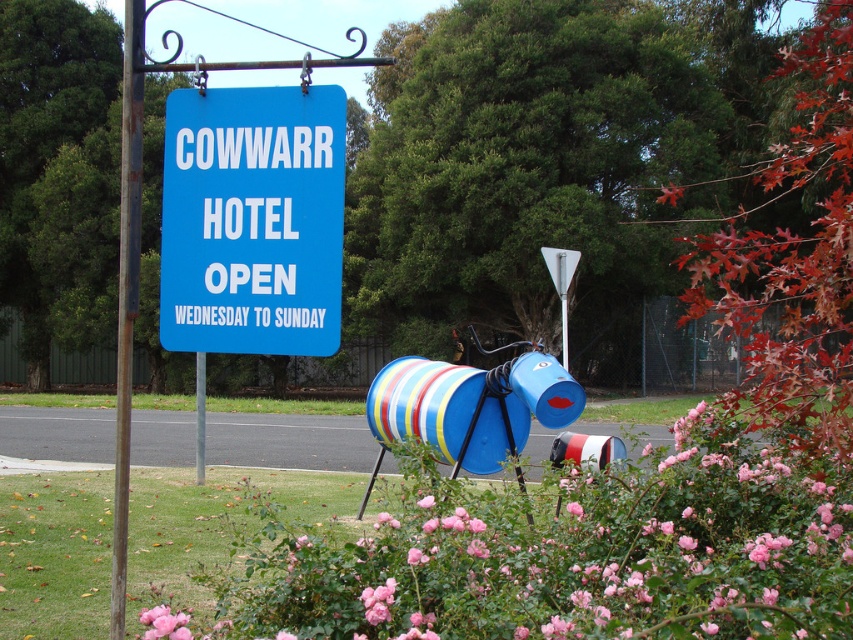
Is pink matte flower at center below rusty metal pole at left?

Yes, pink matte flower at center is below rusty metal pole at left.

Based on the photo, between pink matte flower at center and rusty metal pole at left, which one has more height?

Standing taller between the two is rusty metal pole at left.

What do you see at coordinates (569, 552) in the screenshot? I see `pink matte flower at center` at bounding box center [569, 552].

You are a GUI agent. You are given a task and a screenshot of the screen. Output one action in this format:
    pyautogui.click(x=<x>, y=<y>)
    Task: Click on the pink matte flower at center
    
    Given the screenshot: What is the action you would take?
    pyautogui.click(x=569, y=552)

Is pink matte flower at center above blue plastic sign at upper center?

Incorrect, pink matte flower at center is not positioned above blue plastic sign at upper center.

From the picture: Measure the distance between pink matte flower at center and camera.

pink matte flower at center is 2.21 meters from camera.

Identify the location of pink matte flower at center. (569, 552).

Where is `pink matte flower at center`? pink matte flower at center is located at coordinates (569, 552).

Is point (320, 220) closer to camera compared to point (123, 124)?

That is True.

Describe the element at coordinates (252, 220) in the screenshot. This screenshot has width=853, height=640. I see `blue plastic sign at upper center` at that location.

The height and width of the screenshot is (640, 853). Identify the location of blue plastic sign at upper center. (252, 220).